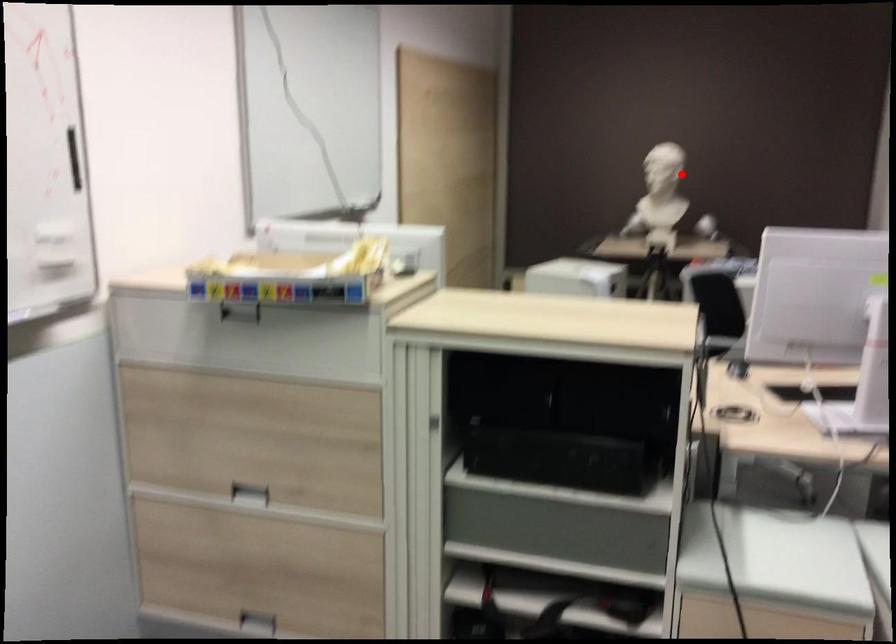
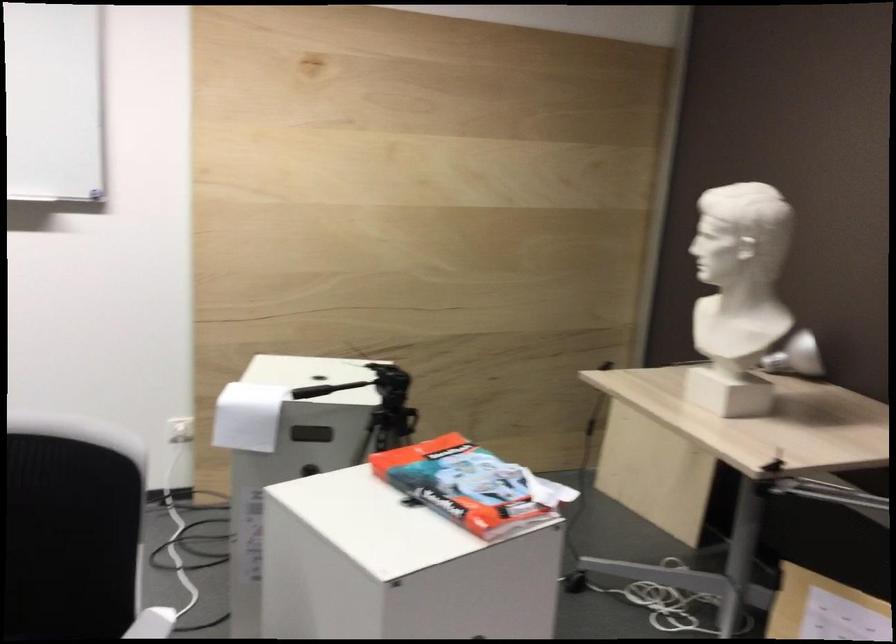
The point at the highlighted location is marked in the first image. Where is the corresponding point in the second image?

(746, 281)